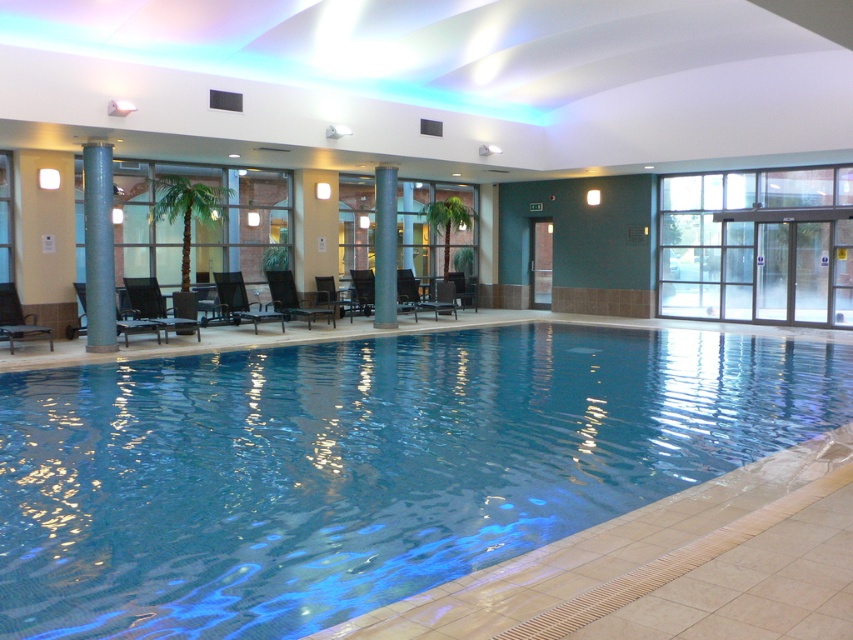
Question: Which point appears closest to the camera in this image?

Choices:
 (A) (318, 282)
 (B) (13, 307)
 (C) (461, 289)

Answer: (B)

Question: Which point is farther from the camera taking this photo?

Choices:
 (A) (387, 243)
 (B) (109, 241)

Answer: (A)

Question: From the image, what is the correct spatial relationship of matte black lounge chair at lower left in relation to dark brown leather chair at center?

Choices:
 (A) left
 (B) right

Answer: (A)

Question: Does matte black lounge chair at center have a lesser width compared to matte black lounge chair at lower left?

Choices:
 (A) no
 (B) yes

Answer: (B)

Question: Considering the relative positions of smooth gray column at center and matte black lounge chair at lower left in the image provided, where is smooth gray column at center located with respect to matte black lounge chair at lower left?

Choices:
 (A) left
 (B) right

Answer: (B)

Question: Among these objects, which one is nearest to the camera?

Choices:
 (A) black plastic chair at center
 (B) black mesh chair at center

Answer: (B)